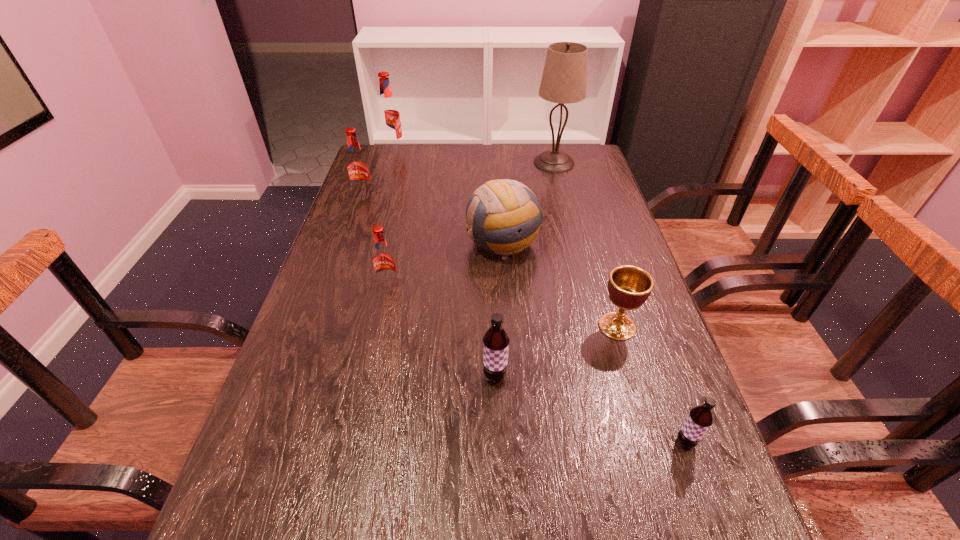
In order to click on object at the far right corner in this screenshot , I will do [x=564, y=80].

Locate an element on the screen. The image size is (960, 540). vacant area at the far edge is located at coordinates (548, 175).

Where is `free space at the left edge of the desktop`? free space at the left edge of the desktop is located at coordinates (260, 453).

You are a GUI agent. You are given a task and a screenshot of the screen. Output one action in this format:
    pyautogui.click(x=<x>, y=<y>)
    Task: Click on the vacant position at the right edge of the desktop
    This screenshot has width=960, height=540.
    Given the screenshot: What is the action you would take?
    pyautogui.click(x=612, y=261)

Identify the location of blank space at the far right corner of the desktop. Image resolution: width=960 pixels, height=540 pixels. (594, 155).

This screenshot has height=540, width=960. I want to click on free spot between the third tallest object and the lampshade, so [x=459, y=180].

Where is `free area in between the volleyball and the biggest red root beer`? Image resolution: width=960 pixels, height=540 pixels. free area in between the volleyball and the biggest red root beer is located at coordinates pos(448,196).

Identify the location of vacant area that lies between the farther brown root beer and the third object from left to right. (442, 332).

This screenshot has width=960, height=540. Identify the location of vacant area that lies between the second nearest object and the fourth farthest object. (499, 310).

The image size is (960, 540). What are the coordinates of `free space between the second farthest red root beer and the second nearest object` in the screenshot? It's located at (429, 287).